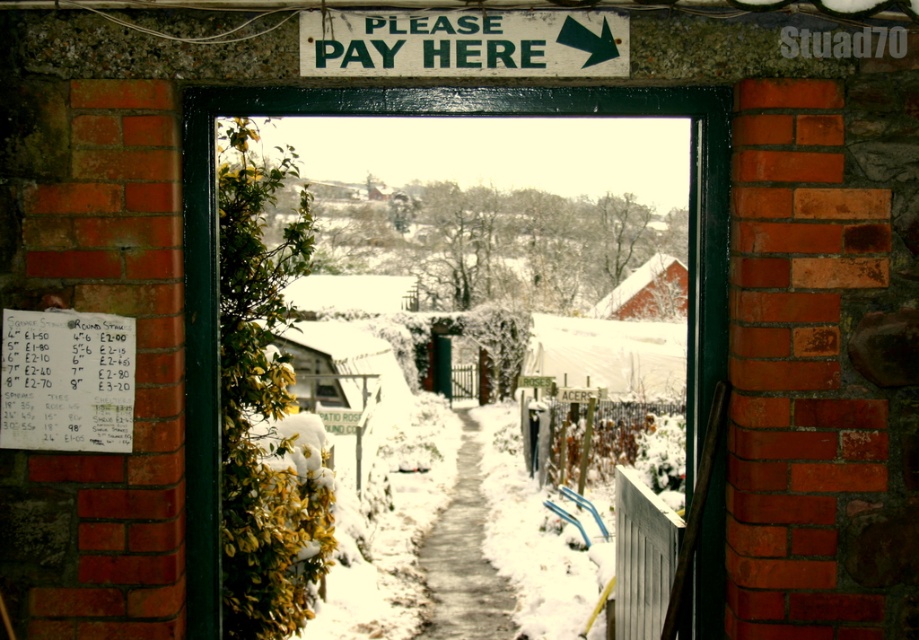
Question: Can you confirm if green wooden door at center is bigger than green painted wooden sign at upper center?

Choices:
 (A) yes
 (B) no

Answer: (A)

Question: Can you confirm if green wooden door at center is bigger than green painted wooden sign at upper center?

Choices:
 (A) yes
 (B) no

Answer: (A)

Question: Which object is closer to the camera taking this photo?

Choices:
 (A) green wooden door at center
 (B) green painted wooden sign at upper center

Answer: (B)

Question: Which point is farther to the camera?

Choices:
 (A) green wooden door at center
 (B) green painted wooden sign at upper center

Answer: (A)

Question: Is green wooden door at center to the right of green painted wooden sign at upper center from the viewer's perspective?

Choices:
 (A) yes
 (B) no

Answer: (B)